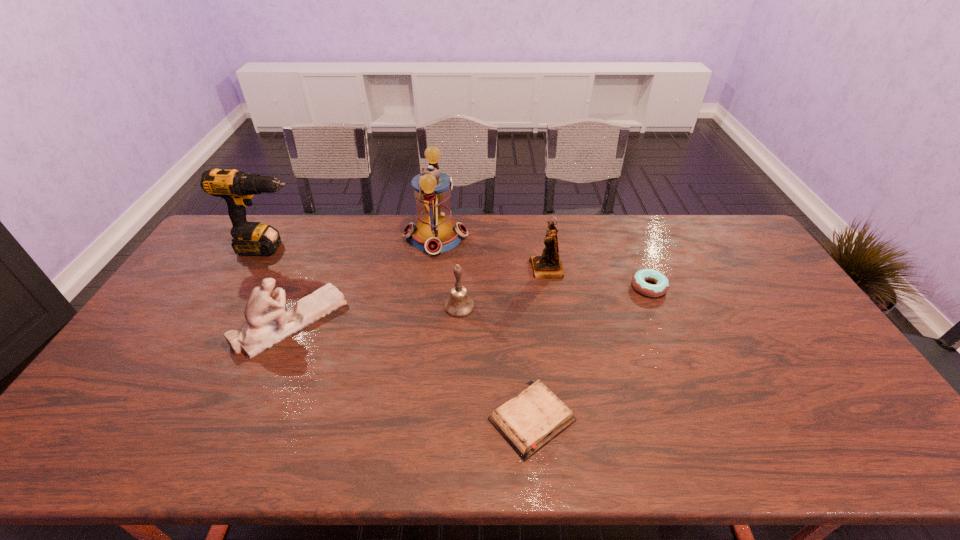
Where is `drill present at the far edge`? This screenshot has height=540, width=960. drill present at the far edge is located at coordinates (237, 188).

Identify the location of object at the near edge. The image size is (960, 540). (527, 422).

I want to click on object that is at the left edge, so click(237, 188).

I want to click on object present at the far left corner, so click(x=237, y=188).

Identify the location of blank area at the far edge. (453, 218).

In the image, there is a desktop. Find the location of `vacant region at the near edge`. vacant region at the near edge is located at coordinates (587, 441).

I want to click on vacant space at the left edge of the desktop, so click(x=216, y=306).

In the image, there is a desktop. Identify the location of vacant space at the right edge. The image size is (960, 540). (766, 332).

The width and height of the screenshot is (960, 540). I want to click on vacant point located between the drill and the nearest object, so click(401, 334).

Identify the location of unoccupied area between the drill and the left figurine. (281, 285).